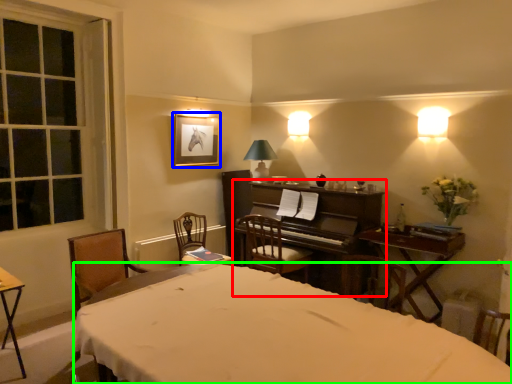
Question: Which object is the closest to the piano (highlighted by a red box)? Choose among these: picture frame (highlighted by a blue box) or bed (highlighted by a green box).

Choices:
 (A) picture frame
 (B) bed

Answer: (A)